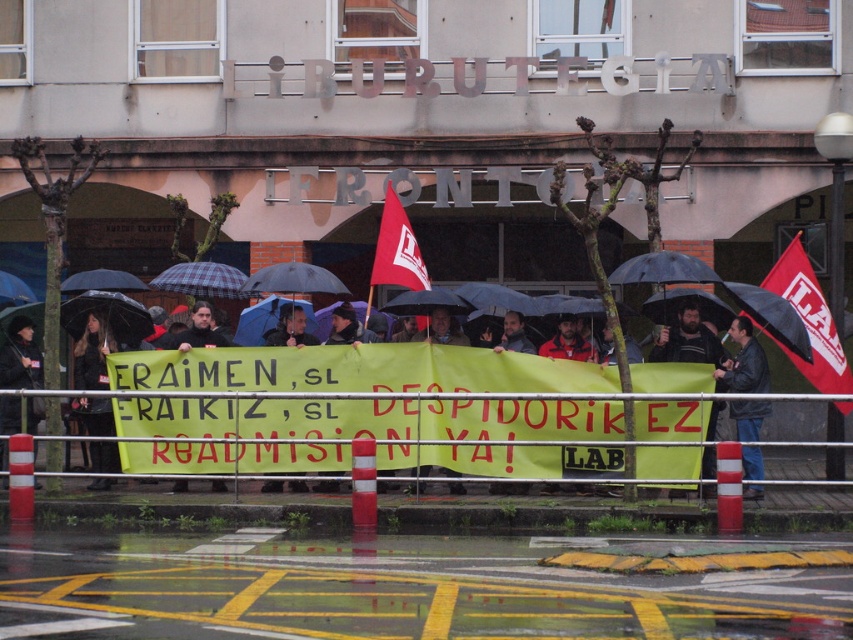
Does dark brown leather jacket at left lie behind matte black jacket at center?

Yes, it is.

Looking at this image, can you confirm if dark brown leather jacket at left is taller than matte black jacket at center?

Correct, dark brown leather jacket at left is much taller as matte black jacket at center.

Locate an element on the screen. dark brown leather jacket at left is located at coordinates (20, 356).

Which is in front, point (746, 412) or point (39, 358)?

Point (746, 412)

In the scene shown: Can you confirm if black leather jacket at right is wider than dark brown leather jacket at left?

Incorrect, black leather jacket at right's width does not surpass dark brown leather jacket at left's.

You are a GUI agent. You are given a task and a screenshot of the screen. Output one action in this format:
    pyautogui.click(x=<x>, y=<y>)
    Task: Click on the black leather jacket at right
    
    Given the screenshot: What is the action you would take?
    pyautogui.click(x=744, y=362)

Consider the image. Can you confirm if red fabric flag at center is positioned to the left of matte black jacket at center?

In fact, red fabric flag at center is to the right of matte black jacket at center.

Based on the photo, is red fabric flag at center above matte black jacket at center?

Indeed, red fabric flag at center is positioned over matte black jacket at center.

I want to click on red fabric flag at center, so click(x=396, y=250).